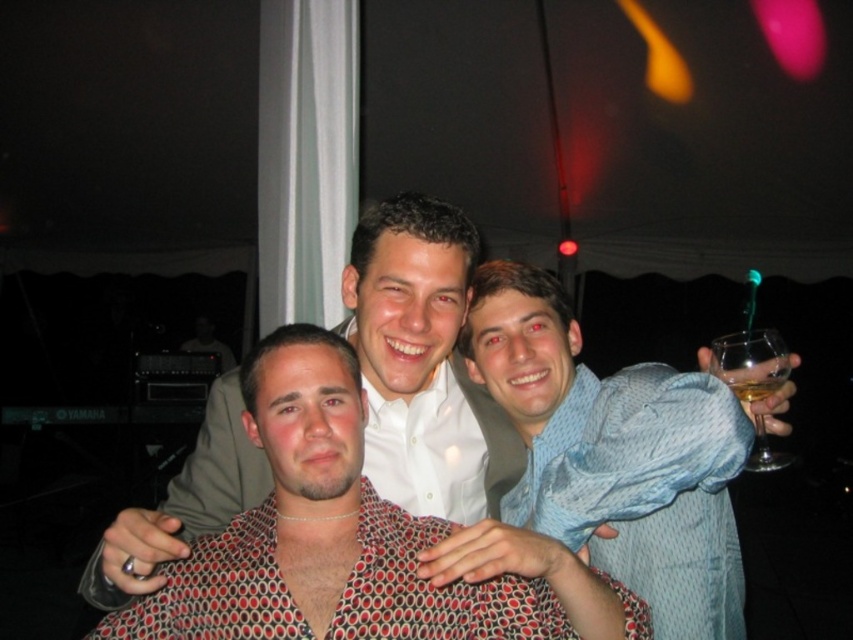
Can you confirm if blue textured shirt at center is positioned to the right of clear glass wine glass at right?

In fact, blue textured shirt at center is to the left of clear glass wine glass at right.

Between point (506, 365) and point (786, 352), which one is positioned behind?

The point (506, 365) is more distant.

Is point (531, 481) closer to viewer compared to point (730, 372)?

No.

This screenshot has height=640, width=853. What are the coordinates of `blue textured shirt at center` in the screenshot? It's located at (614, 452).

Which is below, polka dot shirt at center or blue textured shirt at center?

polka dot shirt at center

What do you see at coordinates (358, 540) in the screenshot?
I see `polka dot shirt at center` at bounding box center [358, 540].

In order to click on polka dot shirt at center in this screenshot , I will do `click(358, 540)`.

Is the position of polka dot shirt at center less distant than that of clear glass wine glass at right?

Yes, it is in front of clear glass wine glass at right.

Between polka dot shirt at center and clear glass wine glass at right, which one has less height?

clear glass wine glass at right

Does point (218, 612) come in front of point (773, 337)?

Yes.

Locate an element on the screen. This screenshot has width=853, height=640. polka dot shirt at center is located at coordinates (358, 540).